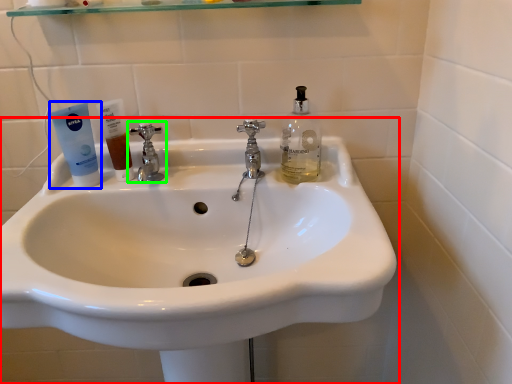
Question: Considering the real-world distances, which object is farthest from sink (highlighted by a red box)? toothpaste (highlighted by a blue box) or tap (highlighted by a green box)?

Choices:
 (A) toothpaste
 (B) tap

Answer: (A)